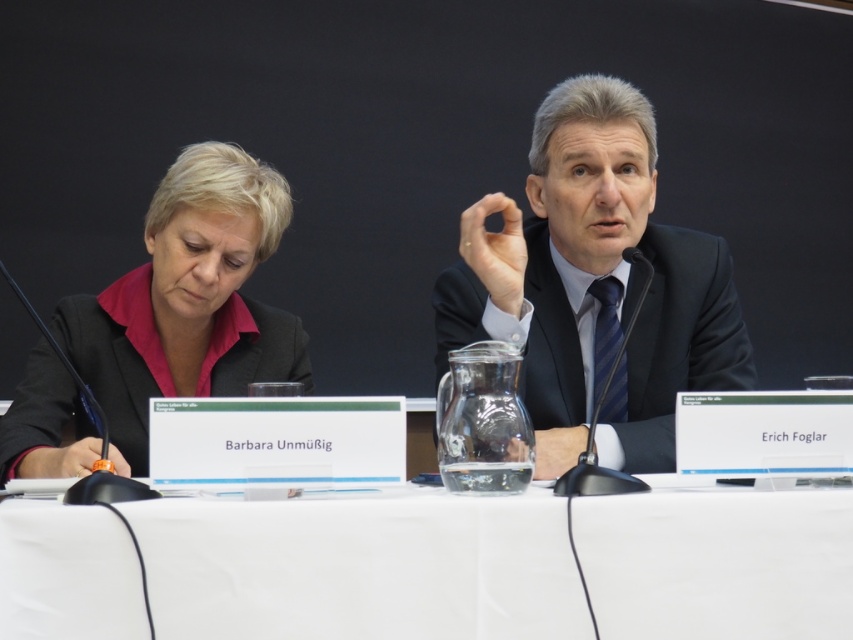
Does point (248, 531) come closer to viewer compared to point (190, 173)?

Yes, it is.

Is point (4, 582) farther from viewer compared to point (113, 394)?

No.

Who is more distant from viewer, (421, 580) or (97, 372)?

Positioned behind is point (97, 372).

Locate an element on the screen. The height and width of the screenshot is (640, 853). white fabric table at center is located at coordinates (361, 564).

Is white fabric table at center to the right of dark blue suit at center from the viewer's perspective?

No, white fabric table at center is not to the right of dark blue suit at center.

What do you see at coordinates (361, 564) in the screenshot?
I see `white fabric table at center` at bounding box center [361, 564].

Where is `white fabric table at center`? white fabric table at center is located at coordinates (361, 564).

Identify the location of dark blue suit at center. (595, 285).

Identify the location of dark blue suit at center. The image size is (853, 640). (595, 285).